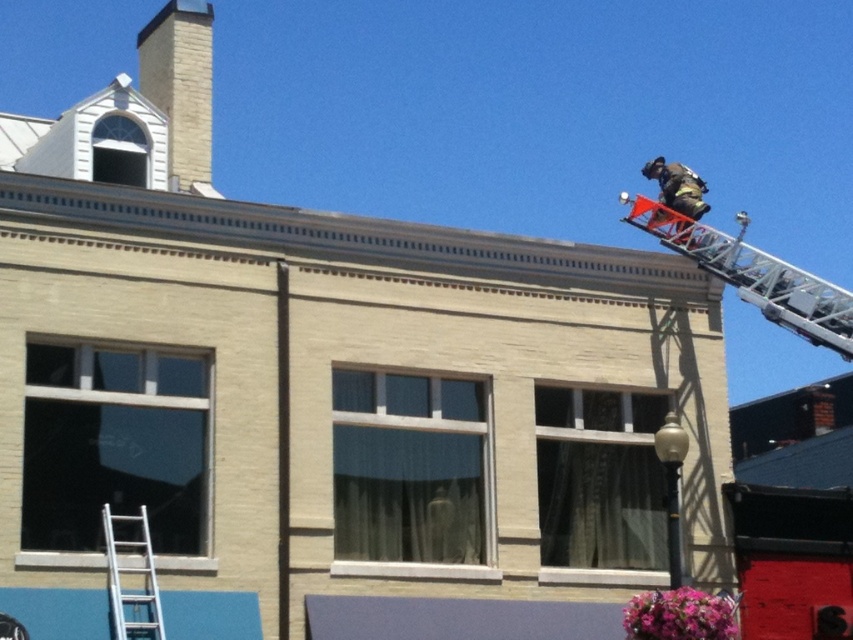
Is silver metallic ladder at lower left closer to the viewer compared to reflective silver helmet at upper right?

That is True.

What do you see at coordinates (131, 572) in the screenshot?
I see `silver metallic ladder at lower left` at bounding box center [131, 572].

Between point (114, 582) and point (695, 209), which one is positioned behind?

Positioned behind is point (695, 209).

At what (x,y) coordinates should I click in order to perform the action: click on silver metallic ladder at lower left. Please return your answer as a coordinate pair (x, y). Image resolution: width=853 pixels, height=640 pixels. Looking at the image, I should click on (131, 572).

Is orange metallic ladder at upper right taller than silver metallic ladder at lower left?

Yes.

Which is below, orange metallic ladder at upper right or silver metallic ladder at lower left?

silver metallic ladder at lower left

Where is `orange metallic ladder at upper right`? orange metallic ladder at upper right is located at coordinates (753, 275).

At what (x,y) coordinates should I click in order to perform the action: click on brick chimney at upper left. Please return your answer as a coordinate pair (x, y). The image size is (853, 640). Looking at the image, I should click on (180, 84).

Which is behind, point (204, 122) or point (140, 525)?

The point (204, 122) is more distant.

Where is `brick chimney at upper left`? Image resolution: width=853 pixels, height=640 pixels. brick chimney at upper left is located at coordinates (180, 84).